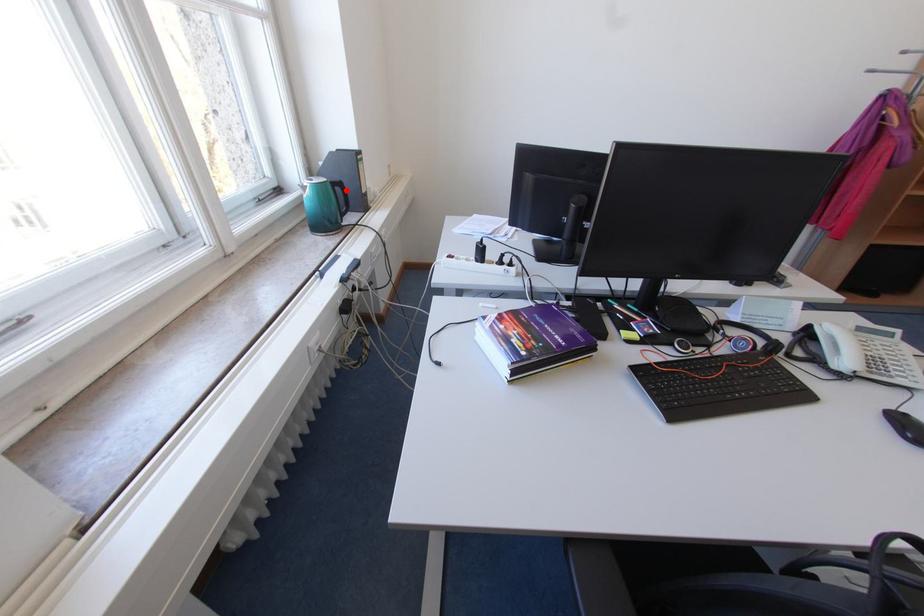
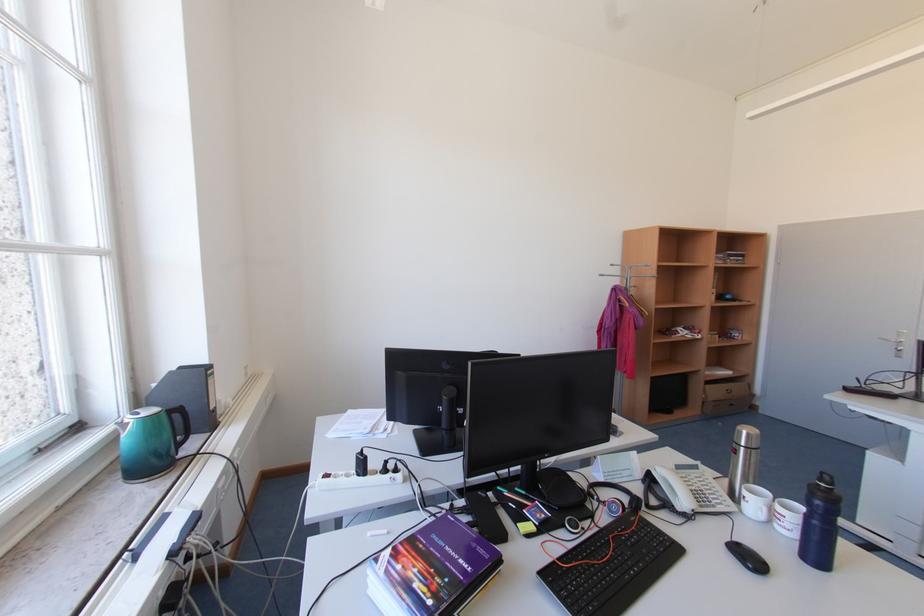
Question: A red point is marked in image1. In image2, is the corresponding 3D point closer to the camera or farther? Reply with the corresponding letter.

Choices:
 (A) The corresponding 3D point is closer.
 (B) The corresponding 3D point is farther.

Answer: (B)